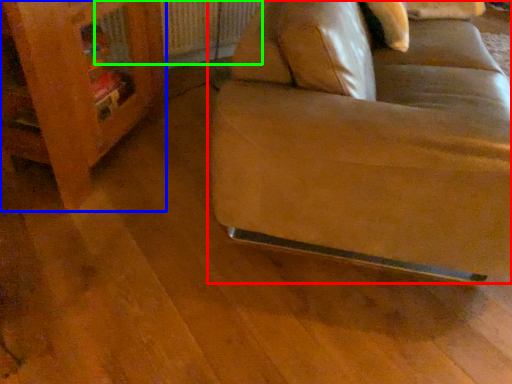
Question: Which object is positioned closest to studio couch (highlighted by a red box)? Select from furniture (highlighted by a blue box) and radiator (highlighted by a green box).

Choices:
 (A) furniture
 (B) radiator

Answer: (A)